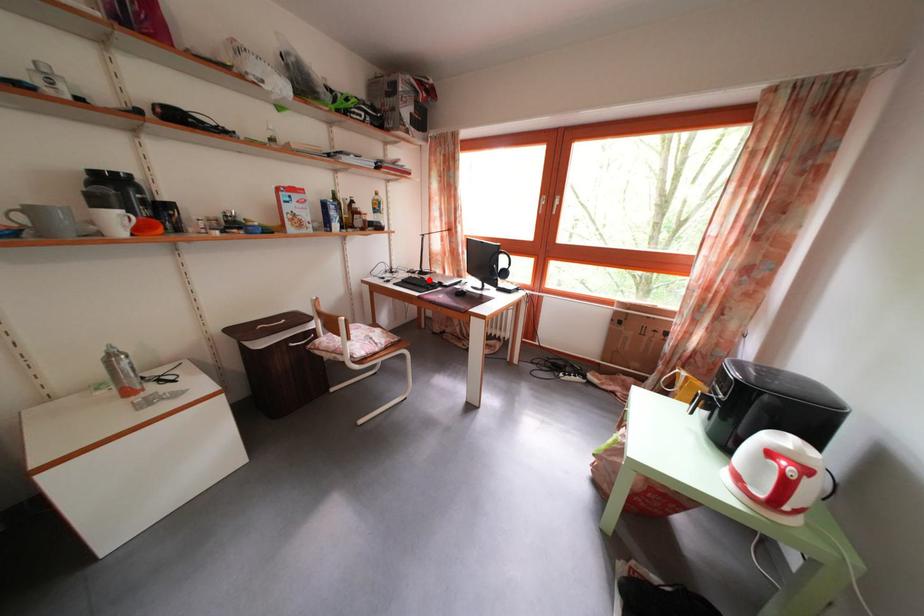
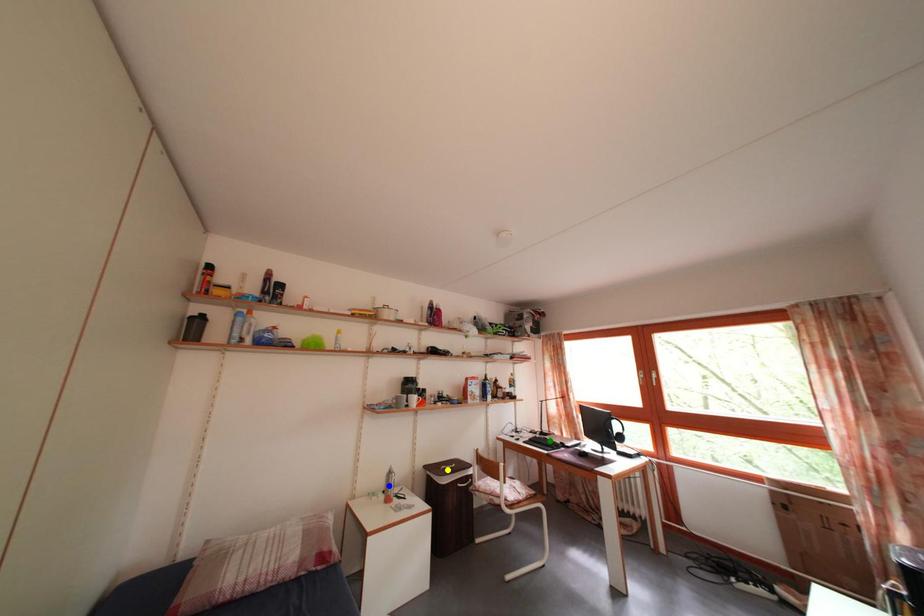
Question: I am providing you with two images of the same scene from different viewpoints. A red point is marked on the first image. You are given multiple points on the second image. Which mark in image 2 goes with the point in image 1?

Choices:
 (A) blue point
 (B) yellow point
 (C) green point

Answer: (C)